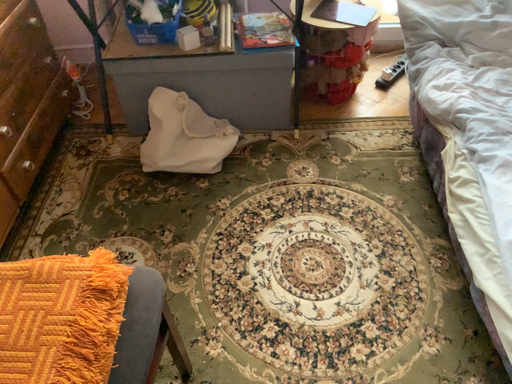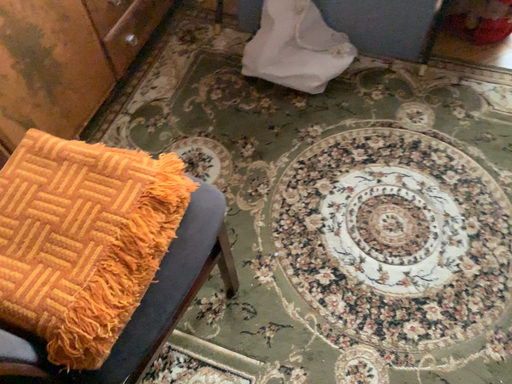
Question: Which way did the camera rotate in the video?

Choices:
 (A) rotated left
 (B) rotated right

Answer: (A)